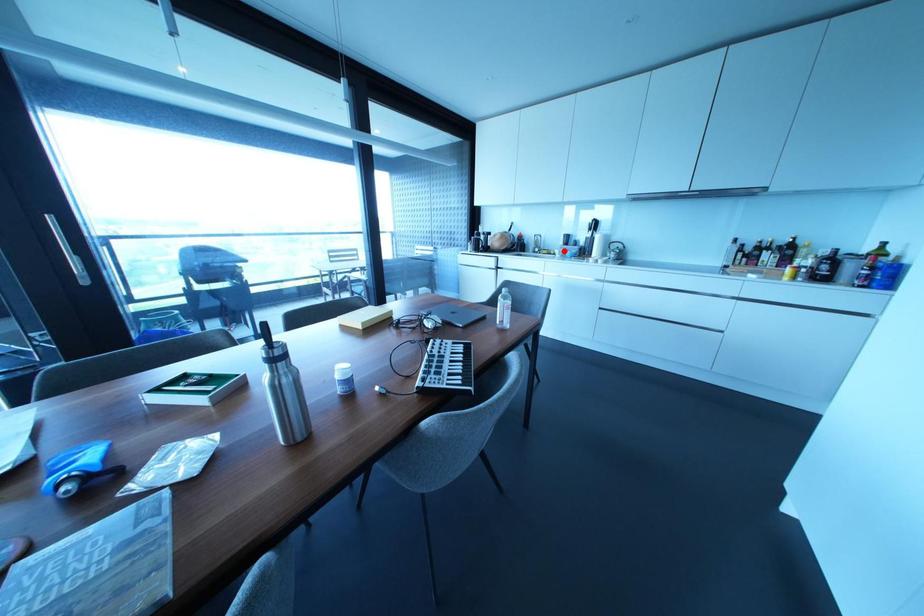
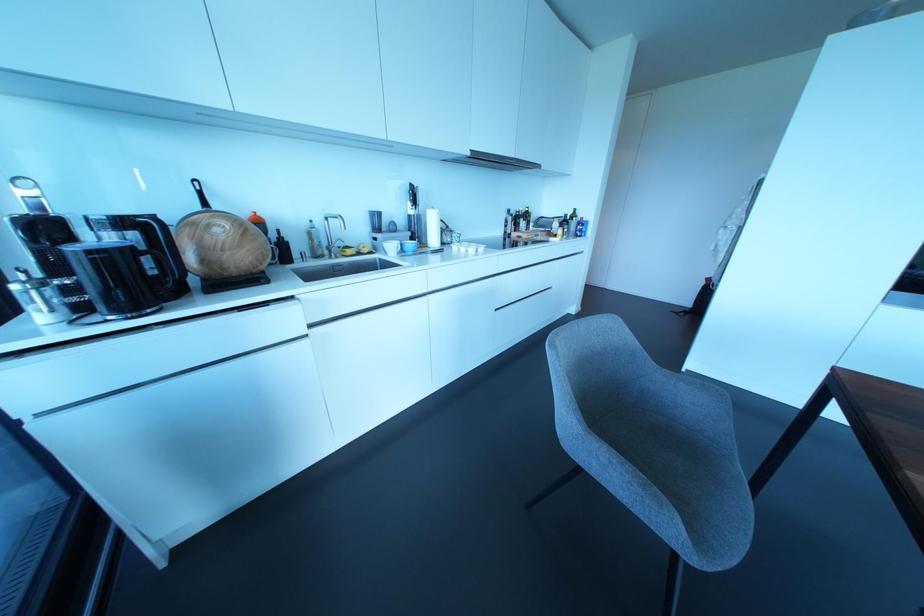
Find the pixel in the second image that matches the highlighted location in the first image.

(400, 244)